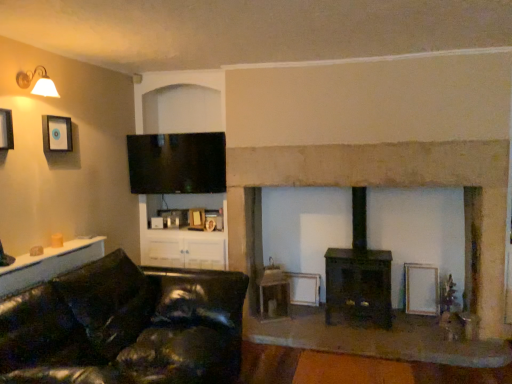
Question: In terms of width, does black leather couch at lower left look wider or thinner when compared to matte black picture frame at upper left, the 1th picture frame viewed from the front?

Choices:
 (A) wide
 (B) thin

Answer: (A)

Question: Visually, is black leather couch at lower left positioned to the left or to the right of matte black picture frame at upper left, the 3th picture frame in the right-to-left sequence?

Choices:
 (A) right
 (B) left

Answer: (A)

Question: Estimate the real-world distances between objects in this image. Which object is farther from the dark brown wood burning stove at center?

Choices:
 (A) matte black picture frame at upper left, arranged as the 3th picture frame when ordered from the bottom
 (B) flat screen tv at upper center
 (C) matte white lamp at upper left
 (D) wooden table at center
 (E) white glossy cabinet at lower left

Answer: (C)

Question: Considering the real-world distances, which object is closest to the matte black picture frame at upper left, the 3th picture frame in the right-to-left sequence?

Choices:
 (A) dark brown wood burning stove at center
 (B) wooden table at center
 (C) white glossy cabinet at lower left
 (D) matte black picture frame at upper left, the second picture frame from the right
 (E) flat screen tv at upper center

Answer: (D)